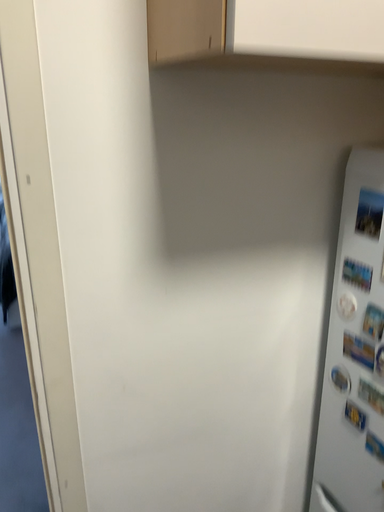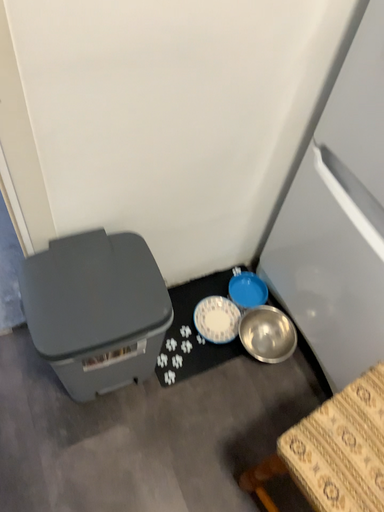
Question: Which way did the camera rotate in the video?

Choices:
 (A) rotated downward
 (B) rotated upward

Answer: (A)